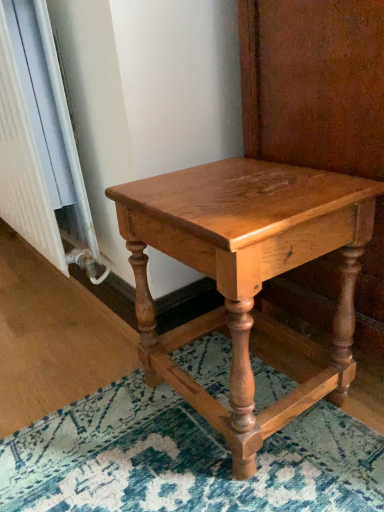
Question: Does white textured radiator at left lie in front of shiny oak table at center?

Choices:
 (A) yes
 (B) no

Answer: (B)

Question: From a real-world perspective, is white textured radiator at left below shiny oak table at center?

Choices:
 (A) yes
 (B) no

Answer: (B)

Question: Is white textured radiator at left next to shiny oak table at center?

Choices:
 (A) yes
 (B) no

Answer: (B)

Question: Is white textured radiator at left facing away from shiny oak table at center?

Choices:
 (A) no
 (B) yes

Answer: (A)

Question: From the image's perspective, is white textured radiator at left on top of shiny oak table at center?

Choices:
 (A) yes
 (B) no

Answer: (A)

Question: Does white textured radiator at left turn towards shiny oak table at center?

Choices:
 (A) yes
 (B) no

Answer: (B)

Question: Does shiny oak table at center have a lesser width compared to white textured radiator at left?

Choices:
 (A) no
 (B) yes

Answer: (A)

Question: From a real-world perspective, is shiny oak table at center located higher than white textured radiator at left?

Choices:
 (A) no
 (B) yes

Answer: (A)

Question: From the image's perspective, is shiny oak table at center under white textured radiator at left?

Choices:
 (A) yes
 (B) no

Answer: (A)

Question: Is shiny oak table at center at the right side of white textured radiator at left?

Choices:
 (A) no
 (B) yes

Answer: (B)

Question: Considering the relative sizes of shiny oak table at center and white textured radiator at left in the image provided, is shiny oak table at center taller than white textured radiator at left?

Choices:
 (A) no
 (B) yes

Answer: (A)

Question: From the image's perspective, is shiny oak table at center above white textured radiator at left?

Choices:
 (A) yes
 (B) no

Answer: (B)

Question: Considering the positions of shiny oak table at center and white textured radiator at left in the image, is shiny oak table at center bigger or smaller than white textured radiator at left?

Choices:
 (A) big
 (B) small

Answer: (B)